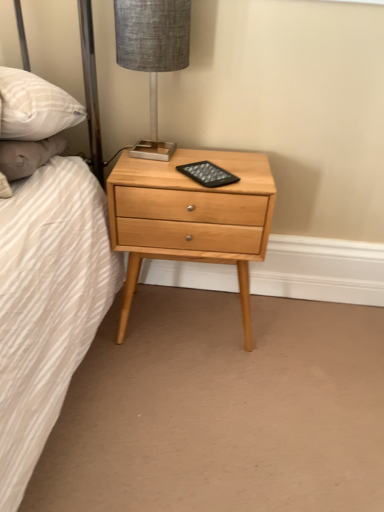
Question: In the image, is natural wood nightstand at center on the left side or the right side of textured gray fabric lampshade at upper center?

Choices:
 (A) left
 (B) right

Answer: (B)

Question: Is natural wood nightstand at center bigger or smaller than textured gray fabric lampshade at upper center?

Choices:
 (A) big
 (B) small

Answer: (A)

Question: In the image, is natural wood nightstand at center positioned in front of or behind textured gray fabric lampshade at upper center?

Choices:
 (A) behind
 (B) front

Answer: (A)

Question: Considering their positions, is textured gray fabric lampshade at upper center located in front of or behind natural wood nightstand at center?

Choices:
 (A) behind
 (B) front

Answer: (B)

Question: From the image's perspective, is textured gray fabric lampshade at upper center located above or below natural wood nightstand at center?

Choices:
 (A) below
 (B) above

Answer: (B)

Question: Looking at their shapes, would you say textured gray fabric lampshade at upper center is wider or thinner than natural wood nightstand at center?

Choices:
 (A) wide
 (B) thin

Answer: (B)

Question: Is textured gray fabric lampshade at upper center inside the boundaries of natural wood nightstand at center, or outside?

Choices:
 (A) outside
 (B) inside

Answer: (A)